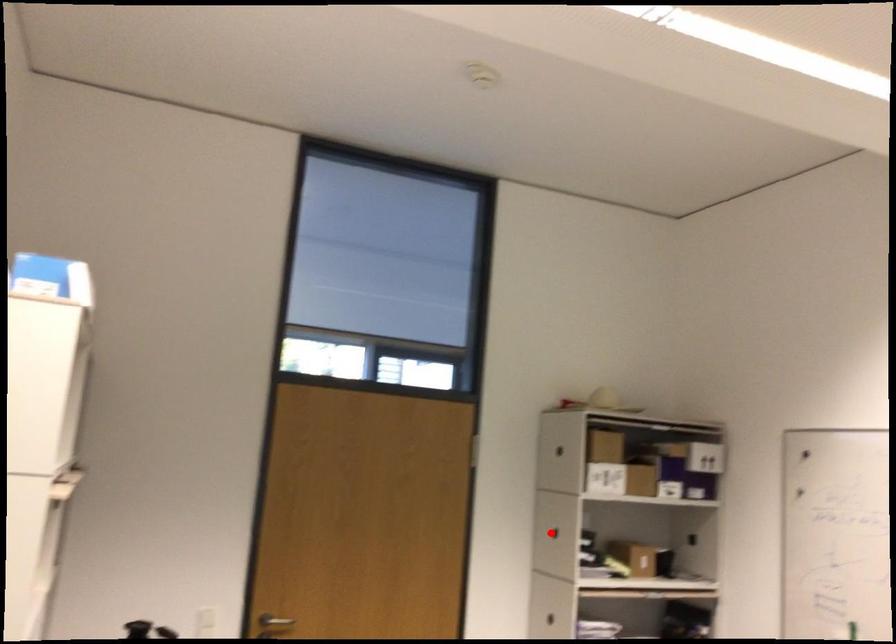
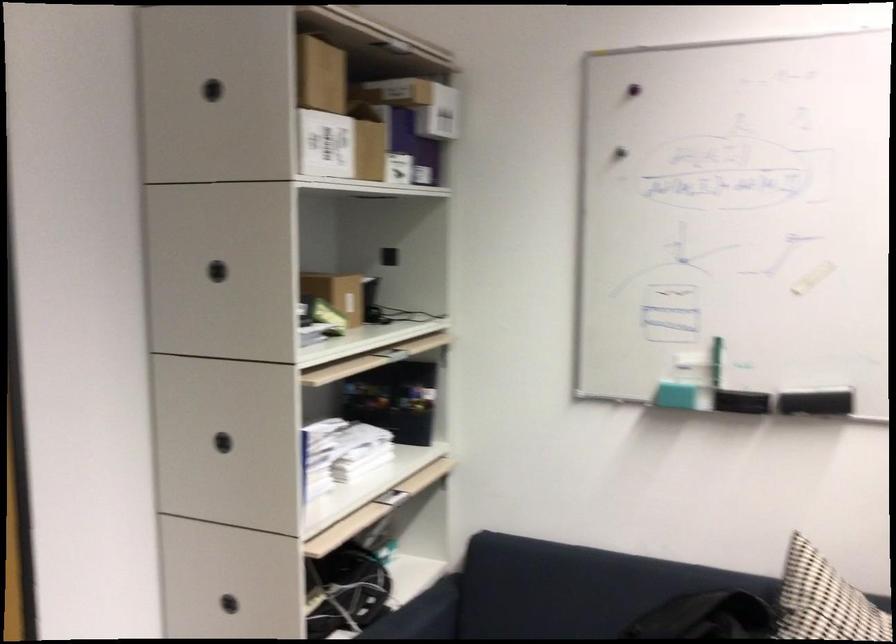
Question: A red point is marked in image1. In image2, is the corresponding 3D point closer to the camera or farther? Reply with the corresponding letter.

Choices:
 (A) The corresponding 3D point is closer.
 (B) The corresponding 3D point is farther.

Answer: (A)